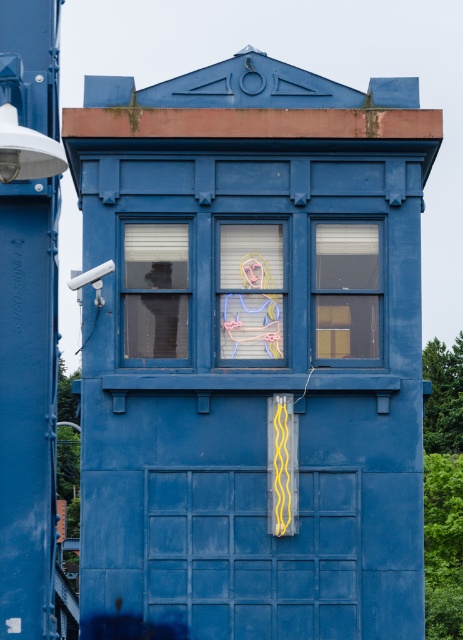
You are a delivery person trying to place a package on the guardhouse. The package is 24 inches long. Can you fit the package between the matte glass window at center and the pastel painted portrait at center?

The matte glass window at center and pastel painted portrait at center are 22.18 inches apart from each other. Since the package is 24 inches long, it cannot fit between them as the space is smaller than the package.

You are an architect inspecting the guardhouse. You notice two matte glass windows at center and matte glass window at center right. Which window has a smaller height?

The matte glass window at center has a lesser height compared to the matte glass window at center right, so the matte glass window at center is smaller in height.

You are standing in front of the guardhouse and want to place a small decoration between the two points, point (370, 264) and point (262, 241). Which point should the decoration be closer to in order to appear closer to the viewer?

The decoration should be placed closer to point (262, 241) because it is closer to the viewer compared to point (370, 264), which is further away.